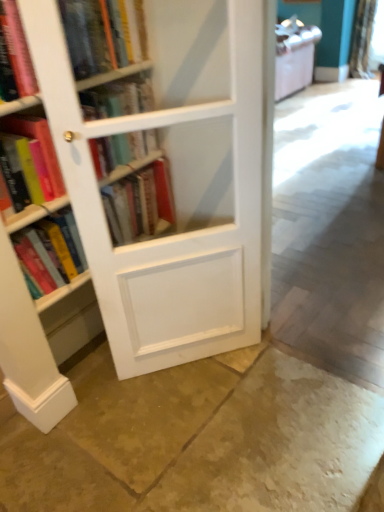
This screenshot has height=512, width=384. Find the location of `hardcover book at upper left, which is counted as the first book, starting from the top`. hardcover book at upper left, which is counted as the first book, starting from the top is located at coordinates (96, 36).

What do you see at coordinates (198, 440) in the screenshot? This screenshot has height=512, width=384. I see `smooth stone floor at center, which is the 1th concrete from bottom to top` at bounding box center [198, 440].

The width and height of the screenshot is (384, 512). What do you see at coordinates (39, 142) in the screenshot?
I see `hardcover book at left, which appears as the fourth book when viewed from the top` at bounding box center [39, 142].

This screenshot has width=384, height=512. I want to click on matte hardcover book at left, the sixth book in the top-to-bottom sequence, so click(50, 252).

Does point (20, 250) lie in front of point (44, 141)?

No.

Is matte hardcover book at left, arranged as the first book when ordered from the bottom, looking in the opposite direction of hardcover book at left, which appears as the fourth book when viewed from the top?

No, hardcover book at left, which appears as the fourth book when viewed from the top, is not at the back of matte hardcover book at left, arranged as the first book when ordered from the bottom.

From the image's perspective, is matte hardcover book at left, arranged as the first book when ordered from the bottom, above or below hardcover book at left, which appears as the fourth book when viewed from the top?

Clearly, from the image's perspective, matte hardcover book at left, arranged as the first book when ordered from the bottom, is below hardcover book at left, which appears as the fourth book when viewed from the top.

Could hardcover book at left, which appears as the fourth book when viewed from the top, be considered to be inside matte hardcover book at left, the sixth book in the top-to-bottom sequence?

No, hardcover book at left, which appears as the fourth book when viewed from the top, is not inside matte hardcover book at left, the sixth book in the top-to-bottom sequence.

Looking at this image, is smooth concrete floor at center, the 2th concrete in the bottom-to-top sequence, facing towards hardcover book at left, arranged as the third book when ordered from the bottom?

No, smooth concrete floor at center, the 2th concrete in the bottom-to-top sequence, is not aimed at hardcover book at left, arranged as the third book when ordered from the bottom.

From a real-world perspective, count 1st books upward from the smooth concrete floor at center, arranged as the first concrete when viewed from the top, and point to it. Please provide its 2D coordinates.

[(39, 142)]

Would you say hardcover book at left, arranged as the third book when ordered from the bottom, is part of smooth concrete floor at center, arranged as the first concrete when viewed from the top,'s contents?

Actually, hardcover book at left, arranged as the third book when ordered from the bottom, is outside smooth concrete floor at center, arranged as the first concrete when viewed from the top.

What's the angular difference between matte hardcover book at left, the sixth book in the top-to-bottom sequence, and hardcover book at center, marked as the fifth book in a top-to-bottom arrangement,'s facing directions?

0.666 degrees.

Choose the correct answer: Is matte hardcover book at left, the sixth book in the top-to-bottom sequence, inside hardcover book at center, marked as the fifth book in a top-to-bottom arrangement, or outside it?

matte hardcover book at left, the sixth book in the top-to-bottom sequence, is spatially situated outside hardcover book at center, marked as the fifth book in a top-to-bottom arrangement.

Is matte hardcover book at left, the sixth book in the top-to-bottom sequence, smaller than hardcover book at center, marked as the fifth book in a top-to-bottom arrangement?

Yes, matte hardcover book at left, the sixth book in the top-to-bottom sequence, is smaller than hardcover book at center, marked as the fifth book in a top-to-bottom arrangement.

Can you confirm if matte hardcover book at left, arranged as the first book when ordered from the bottom, is positioned to the right of hardcover book at center, which ranks as the second book in bottom-to-top order?

Incorrect, matte hardcover book at left, arranged as the first book when ordered from the bottom, is not on the right side of hardcover book at center, which ranks as the second book in bottom-to-top order.

From the image's perspective, would you say matte pink book at left, placed as the fifth book when sorted from bottom to top, is shown under white sheer curtain at upper right?

Yes, from the image's perspective, matte pink book at left, placed as the fifth book when sorted from bottom to top, is below white sheer curtain at upper right.

Considering the relative positions of matte pink book at left, placed as the 2th book when sorted from top to bottom, and white sheer curtain at upper right in the image provided, is matte pink book at left, placed as the 2th book when sorted from top to bottom, behind white sheer curtain at upper right?

No, matte pink book at left, placed as the 2th book when sorted from top to bottom, is in front of white sheer curtain at upper right.

Is point (8, 22) closer or farther from the camera than point (351, 68)?

Point (8, 22) is positioned closer to the camera compared to point (351, 68).

Is smooth stone floor at center, which is the second concrete in top-to-bottom order, turned away from hardcover book at upper left, placed as the 6th book when sorted from bottom to top?

No.

Is smooth stone floor at center, which is the second concrete in top-to-bottom order, to the left of hardcover book at upper left, which is counted as the first book, starting from the top, from the viewer's perspective?

In fact, smooth stone floor at center, which is the second concrete in top-to-bottom order, is to the right of hardcover book at upper left, which is counted as the first book, starting from the top.

From a real-world perspective, between smooth stone floor at center, which is the 1th concrete from bottom to top, and hardcover book at upper left, placed as the 6th book when sorted from bottom to top, who is vertically higher?

hardcover book at upper left, placed as the 6th book when sorted from bottom to top, from a real-world perspective.

Considering the relative sizes of smooth stone floor at center, which is the second concrete in top-to-bottom order, and hardcover book at upper left, placed as the 6th book when sorted from bottom to top, in the image provided, is smooth stone floor at center, which is the second concrete in top-to-bottom order, thinner than hardcover book at upper left, placed as the 6th book when sorted from bottom to top,?

No.

Between white wood bookcase at left and matte pink book at left, placed as the fifth book when sorted from bottom to top, which one has smaller size?

matte pink book at left, placed as the fifth book when sorted from bottom to top, is smaller.

From the image's perspective, between white wood bookcase at left and matte pink book at left, placed as the fifth book when sorted from bottom to top, which one is located above?

matte pink book at left, placed as the fifth book when sorted from bottom to top.

Is white wood bookcase at left oriented towards matte pink book at left, placed as the fifth book when sorted from bottom to top?

No, white wood bookcase at left is not oriented towards matte pink book at left, placed as the fifth book when sorted from bottom to top.

Between hardcover book at center, marked as the fifth book in a top-to-bottom arrangement, and white sheer curtain at upper right, which one has smaller width?

hardcover book at center, marked as the fifth book in a top-to-bottom arrangement, is thinner.

Is hardcover book at center, which ranks as the second book in bottom-to-top order, behind white sheer curtain at upper right?

No, the depth of hardcover book at center, which ranks as the second book in bottom-to-top order, is less than that of white sheer curtain at upper right.

From the image's perspective, would you say hardcover book at center, which ranks as the second book in bottom-to-top order, is shown under white sheer curtain at upper right?

Yes.

Where is `the 1st book to the left of the white sheer curtain at upper right, starting your count from the anchor`? the 1st book to the left of the white sheer curtain at upper right, starting your count from the anchor is located at coordinates [140, 203].

Find the location of `the 2nd book counting from the right side of the hardcover book at left, arranged as the third book when ordered from the bottom`. the 2nd book counting from the right side of the hardcover book at left, arranged as the third book when ordered from the bottom is located at coordinates (50, 252).

Starting from the smooth concrete floor at center, arranged as the first concrete when viewed from the top, which book is the 2nd one behind? Please provide its 2D coordinates.

[(39, 142)]

Looking at the image, which one is located further to hardcover book at left, marked as the 4th book in a bottom-to-top arrangement, white sheer curtain at upper right or matte hardcover book at left, arranged as the first book when ordered from the bottom?

white sheer curtain at upper right.

Consider the image. Based on their spatial positions, is hardcover book at left, marked as the 4th book in a bottom-to-top arrangement, or smooth stone floor at center, which is the 1th concrete from bottom to top, further from smooth concrete floor at center, arranged as the first concrete when viewed from the top?

Based on the image, hardcover book at left, marked as the 4th book in a bottom-to-top arrangement, appears to be further to smooth concrete floor at center, arranged as the first concrete when viewed from the top.

Estimate the real-world distances between objects in this image. Which object is closer to smooth stone floor at center, which is the second concrete in top-to-bottom order, matte pink book at left, placed as the 2th book when sorted from top to bottom, or white wood bookcase at left?

white wood bookcase at left is closer to smooth stone floor at center, which is the second concrete in top-to-bottom order.

Which object lies further to the anchor point matte hardcover book at left, arranged as the first book when ordered from the bottom, hardcover book at upper left, placed as the 6th book when sorted from bottom to top, or white wood bookcase at left?

Based on the image, hardcover book at upper left, placed as the 6th book when sorted from bottom to top, appears to be further to matte hardcover book at left, arranged as the first book when ordered from the bottom.

In the scene shown: Estimate the real-world distances between objects in this image. Which object is further from hardcover book at upper left, placed as the 6th book when sorted from bottom to top, smooth concrete floor at center, arranged as the first concrete when viewed from the top, or white sheer curtain at upper right?

The object further to hardcover book at upper left, placed as the 6th book when sorted from bottom to top, is white sheer curtain at upper right.

When comparing their distances from hardcover book at center, which ranks as the second book in bottom-to-top order, does white sheer curtain at upper right or white wood bookcase at left seem further?

Among the two, white sheer curtain at upper right is located further to hardcover book at center, which ranks as the second book in bottom-to-top order.

From the image, which object appears to be nearer to matte pink book at left, placed as the fifth book when sorted from bottom to top, matte hardcover book at left, arranged as the first book when ordered from the bottom, or smooth stone floor at center, which is the 1th concrete from bottom to top?

The object closer to matte pink book at left, placed as the fifth book when sorted from bottom to top, is matte hardcover book at left, arranged as the first book when ordered from the bottom.

Estimate the real-world distances between objects in this image. Which object is further from hardcover book at upper left, placed as the 6th book when sorted from bottom to top, hardcover book at left, marked as the 4th book in a bottom-to-top arrangement, or smooth stone floor at center, which is the second concrete in top-to-bottom order?

smooth stone floor at center, which is the second concrete in top-to-bottom order, lies further to hardcover book at upper left, placed as the 6th book when sorted from bottom to top, than the other object.

Identify the location of concrete between white wood bookcase at left and smooth stone floor at center, which is the second concrete in top-to-bottom order, from top to bottom. (330, 230).

What are the coordinates of `book located between hardcover book at left, marked as the 4th book in a bottom-to-top arrangement, and white sheer curtain at upper right in the depth direction` in the screenshot? It's located at (140, 203).

Where is `bookcase located between hardcover book at left, marked as the 4th book in a bottom-to-top arrangement, and smooth concrete floor at center, the 2th concrete in the bottom-to-top sequence, in the left-right direction`? bookcase located between hardcover book at left, marked as the 4th book in a bottom-to-top arrangement, and smooth concrete floor at center, the 2th concrete in the bottom-to-top sequence, in the left-right direction is located at coordinates (178, 180).

Where is `concrete between matte hardcover book at left, the sixth book in the top-to-bottom sequence, and smooth concrete floor at center, arranged as the first concrete when viewed from the top, in the horizontal direction`? concrete between matte hardcover book at left, the sixth book in the top-to-bottom sequence, and smooth concrete floor at center, arranged as the first concrete when viewed from the top, in the horizontal direction is located at coordinates (198, 440).